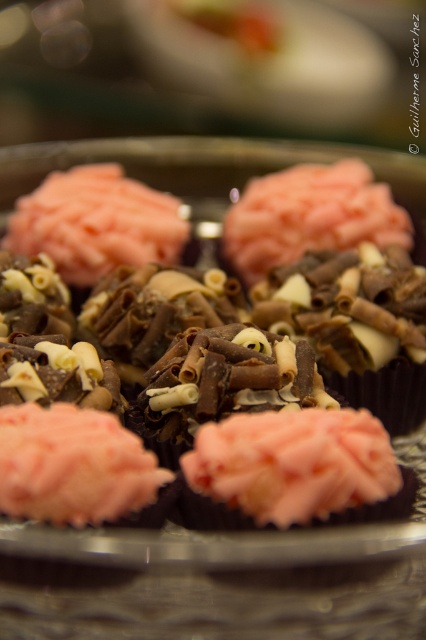
You are a baker who needs to place a decorative chocolate cupcake on the table. You see the pink frosted cupcake at center and the pink matte frosting at center. Which one is higher?

The pink frosted cupcake at center is located above the pink matte frosting at center, so the pink frosted cupcake at center is higher.

You are a food stylist arranging cupcakes on a plate. You have a pink matte frosting at center and a pink frosted cupcake at lower left. If you want to create depth in your arrangement, which item should you place closer to the viewer?

The pink matte frosting at center should be placed closer to the viewer since it is further to the viewer than the pink frosted cupcake at lower left, creating a layered effect.

You are holding a camera and want to take a closeup photo of the pink frosted cupcake at center. The camera requires the subject to be at least 25 inches away to focus properly. Based on the scene description, will the cupcake be in focus?

The pink frosted cupcake at center is 24.61 inches away from camera, which is less than the required 25 inches. Therefore, the cupcake will not be in focus.